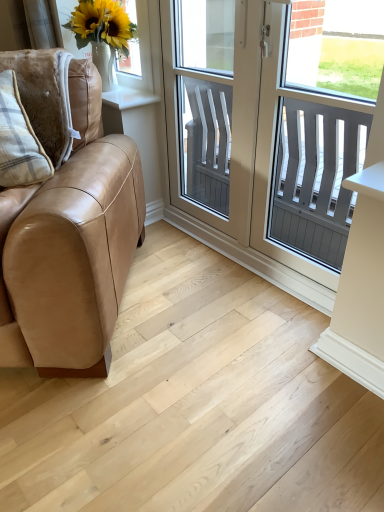
Question: From the image's perspective, would you say clear glass screen door at center is shown under light wood floor at lower left?

Choices:
 (A) no
 (B) yes

Answer: (A)

Question: Considering the relative sizes of clear glass screen door at center and light wood floor at lower left in the image provided, is clear glass screen door at center bigger than light wood floor at lower left?

Choices:
 (A) no
 (B) yes

Answer: (A)

Question: Is clear glass screen door at center smaller than light wood floor at lower left?

Choices:
 (A) no
 (B) yes

Answer: (B)

Question: Is clear glass screen door at center facing away from light wood floor at lower left?

Choices:
 (A) yes
 (B) no

Answer: (B)

Question: Would you say clear glass screen door at center contains light wood floor at lower left?

Choices:
 (A) yes
 (B) no

Answer: (B)

Question: From a real-world perspective, is clear glass screen door at center on light wood floor at lower left?

Choices:
 (A) yes
 (B) no

Answer: (A)

Question: Is clear glass screen door at center outside of plaid fabric pillow at left?

Choices:
 (A) yes
 (B) no

Answer: (A)

Question: Is clear glass screen door at center positioned before plaid fabric pillow at left?

Choices:
 (A) yes
 (B) no

Answer: (B)

Question: Does clear glass screen door at center have a larger size compared to plaid fabric pillow at left?

Choices:
 (A) no
 (B) yes

Answer: (B)

Question: From a real-world perspective, is clear glass screen door at center physically below plaid fabric pillow at left?

Choices:
 (A) yes
 (B) no

Answer: (A)

Question: Considering the relative sizes of clear glass screen door at center and plaid fabric pillow at left in the image provided, is clear glass screen door at center smaller than plaid fabric pillow at left?

Choices:
 (A) yes
 (B) no

Answer: (B)

Question: Can you confirm if clear glass screen door at center is thinner than plaid fabric pillow at left?

Choices:
 (A) no
 (B) yes

Answer: (B)

Question: Does light wood floor at lower left have a smaller size compared to white plastic window at center?

Choices:
 (A) yes
 (B) no

Answer: (B)